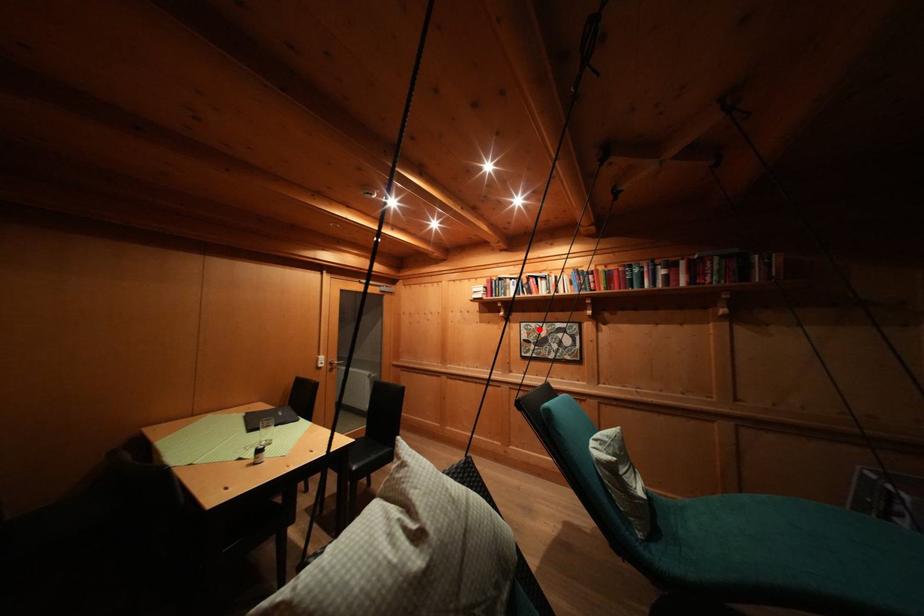
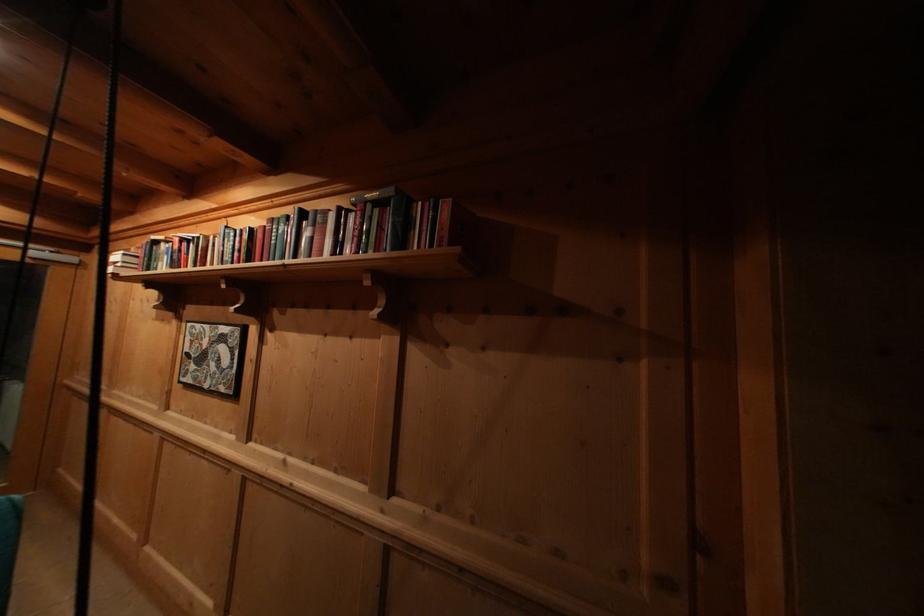
Question: I am providing you with two images of the same scene from different viewpoints. A red point is marked on the first image. At the location where the point appears in image 1, is it still visible in image 2?

Choices:
 (A) Yes
 (B) No

Answer: (A)